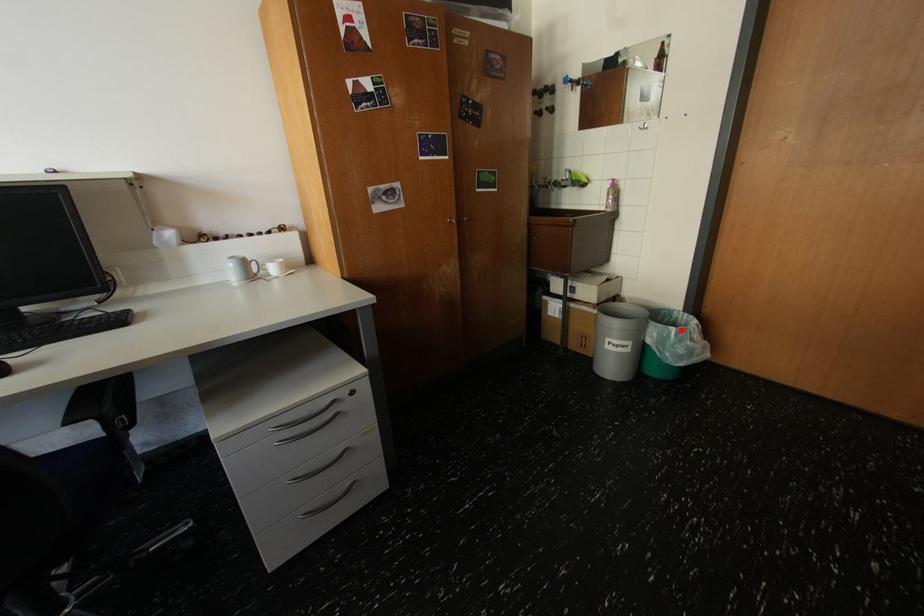
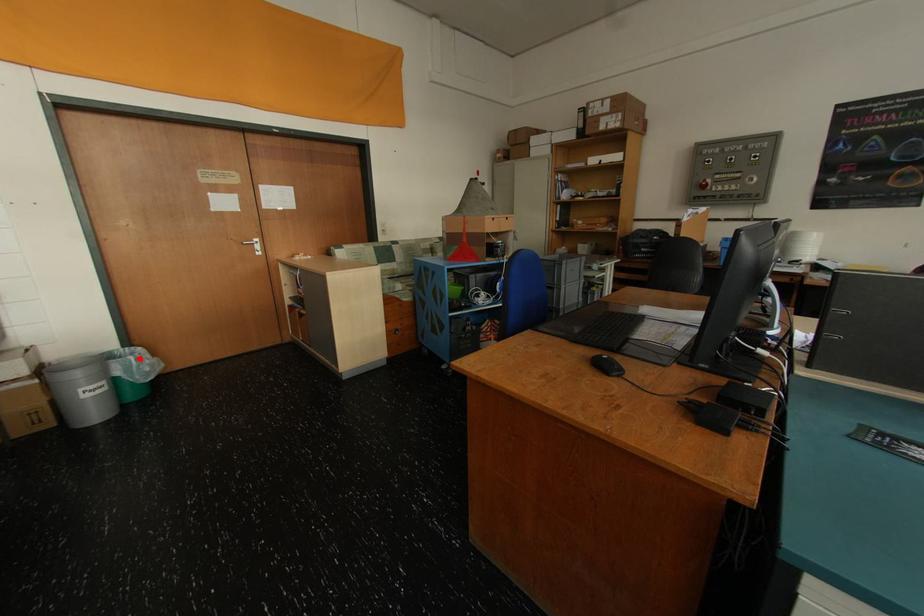
I am providing you with two images of the same scene from different viewpoints. A red point is marked on the first image and another point is marked on the second image. Do the highlighted points in image1 and image2 indicate the same real-world spot?

Yes